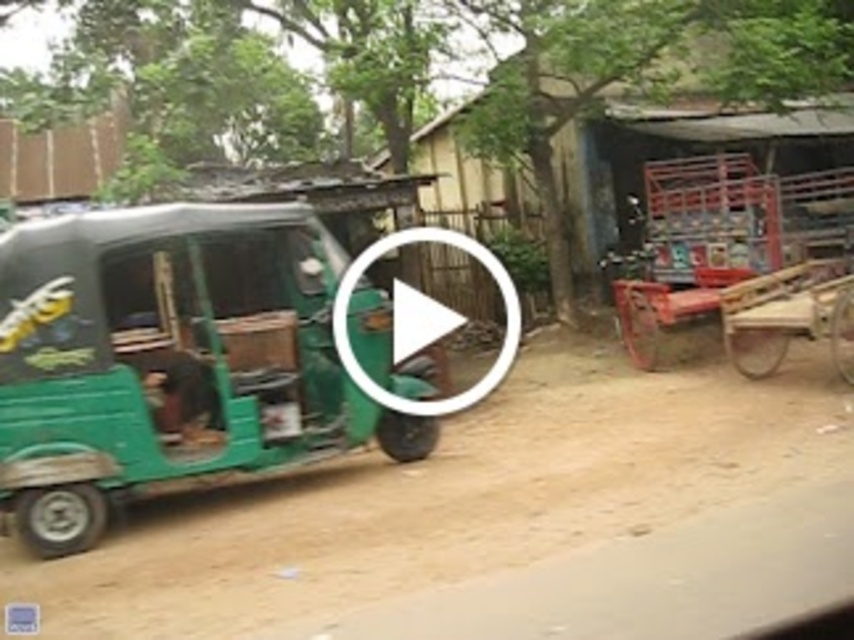
Can you confirm if green matte auto-rickshaw at left is smaller than rusty metal cart at right?

Indeed, green matte auto-rickshaw at left has a smaller size compared to rusty metal cart at right.

Is point (250, 273) farther from viewer compared to point (708, 285)?

No, (250, 273) is closer to viewer.

I want to click on green matte auto-rickshaw at left, so click(x=168, y=356).

Identify the location of green matte auto-rickshaw at left. (168, 356).

Based on the photo, does brown dirt track at center have a smaller size compared to rustic wooden hut at center?

Correct, brown dirt track at center occupies less space than rustic wooden hut at center.

Between brown dirt track at center and rustic wooden hut at center, which one appears on the left side from the viewer's perspective?

brown dirt track at center

Who is more distant from viewer, [636,451] or [495,108]?

The point [495,108] is behind.

Identify the location of brown dirt track at center. The height and width of the screenshot is (640, 854). (449, 497).

Image resolution: width=854 pixels, height=640 pixels. What do you see at coordinates (449, 497) in the screenshot? I see `brown dirt track at center` at bounding box center [449, 497].

Is brown dirt track at center to the right of rusty metal cart at right from the viewer's perspective?

In fact, brown dirt track at center is to the left of rusty metal cart at right.

Which is behind, point (468, 449) or point (706, 272)?

Positioned behind is point (706, 272).

The height and width of the screenshot is (640, 854). What are the coordinates of `brown dirt track at center` in the screenshot? It's located at (449, 497).